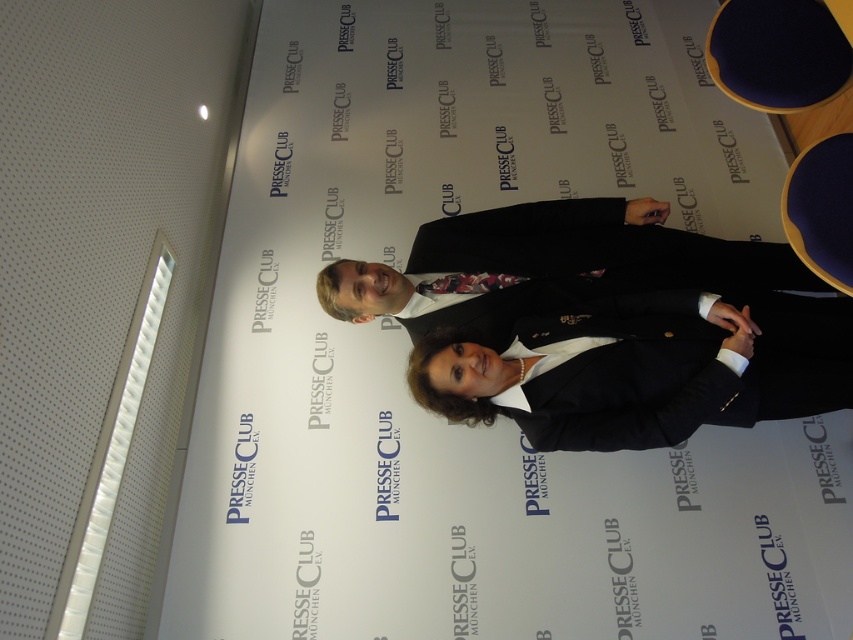
You are standing in the scene and want to move from the point at coordinates point (x=451, y=413) to the point at coordinates point (x=418, y=289). Which direction should you move to get closer to the latter?

To move from point (x=451, y=413) to point (x=418, y=289), you should move to the left and slightly forward since point (x=451, y=413) is in front of point (x=418, y=289).

You are a photographer setting up for a press event. You need to ensure that the dark suit at center and the floral silk tie at center are both visible in the photo. Based on their positions, which one should you focus on first to ensure the entire area is captured?

The dark suit at center is above the floral silk tie at center, so focusing on the dark suit at center first will ensure the entire area is captured as it is positioned higher up.

Consider the image. You are a photographer setting up for a group photo. You need to position a light source to the left of the dark suit at center. Where exactly should you place the light source based on the scene description?

The light source should be placed to the left of the dark suit at center, near the perforated wall or ceiling section mentioned in the scene description.